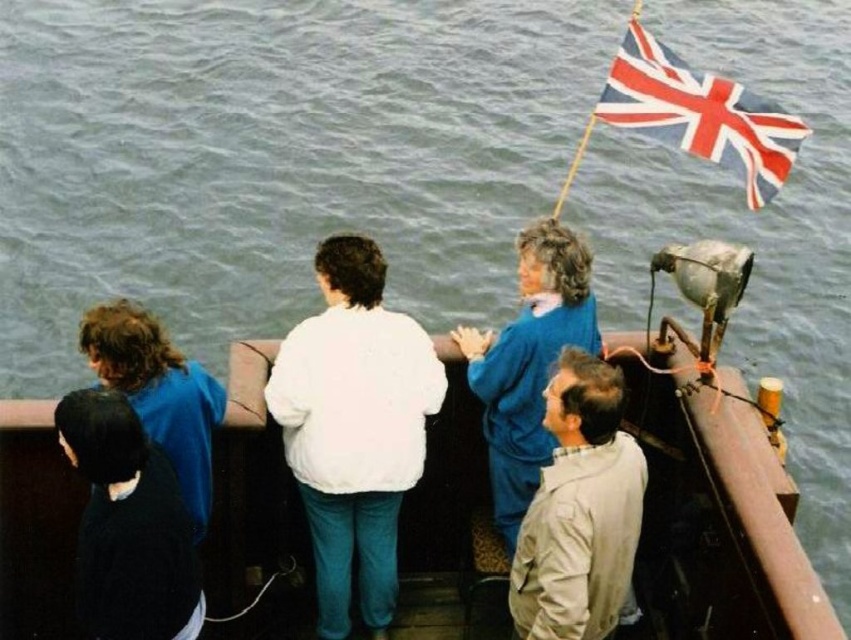
Question: Does black matte jacket at lower left have a larger size compared to blue fabric jacket at center?

Choices:
 (A) yes
 (B) no

Answer: (A)

Question: Among these points, which one is farthest from the camera?

Choices:
 (A) (540, 248)
 (B) (608, 582)
 (C) (133, 572)

Answer: (A)

Question: In this image, where is white fleece jacket at center located relative to blue fabric jacket at center?

Choices:
 (A) below
 (B) above

Answer: (A)

Question: Is blue fabric jacket at center to the right of dark blue fabric jacket at lower left from the viewer's perspective?

Choices:
 (A) yes
 (B) no

Answer: (A)

Question: Based on their relative distances, which object is farther from the light beige fabric jacket at lower right?

Choices:
 (A) white fleece jacket at center
 (B) union jack fabric flag at upper right

Answer: (B)

Question: Which point appears closest to the camera in this image?

Choices:
 (A) (471, 340)
 (B) (78, 422)
 (C) (700, 120)
 (D) (553, 484)

Answer: (B)